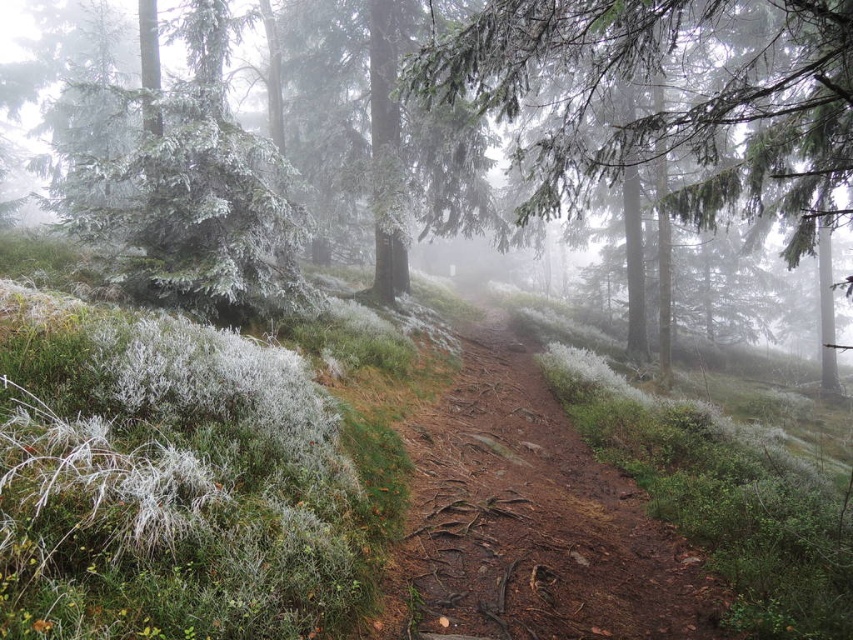
Looking at this image, you are a hiker carrying a large backpack and need to walk along the dirt path at center. Considering the width of the path, will you have enough space to pass through without touching the frosted evergreen tree at upper left?

The dirt path at center has a lesser width compared to frosted evergreen tree at upper left, so the path is narrower than the tree. Since the path is narrow, the hiker may have limited space and might need to be cautious to avoid touching the frosted evergreen tree at upper left while passing through.